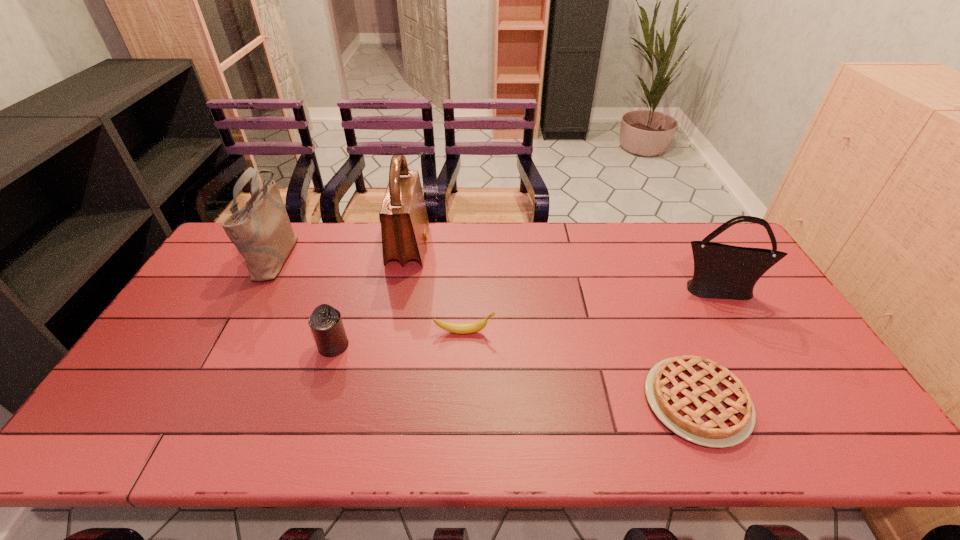
You are a GUI agent. You are given a task and a screenshot of the screen. Output one action in this format:
    pyautogui.click(x=<x>, y=<y>)
    Task: Click on the fourth object from right to left
    The height and width of the screenshot is (540, 960).
    Given the screenshot: What is the action you would take?
    pyautogui.click(x=404, y=221)

I want to click on the leftmost object, so click(x=261, y=230).

You are a GUI agent. You are given a task and a screenshot of the screen. Output one action in this format:
    pyautogui.click(x=<x>, y=<y>)
    Task: Click on the third tallest object
    
    Given the screenshot: What is the action you would take?
    pyautogui.click(x=721, y=271)

Find the location of a particular element. The width and height of the screenshot is (960, 540). the shortest shoulder bag is located at coordinates (721, 271).

The width and height of the screenshot is (960, 540). I want to click on the third shortest object, so click(x=325, y=322).

Find the location of a particular element. The height and width of the screenshot is (540, 960). can is located at coordinates (325, 322).

Locate an element on the screen. Image resolution: width=960 pixels, height=540 pixels. banana is located at coordinates (459, 328).

Where is `the second shortest object`? the second shortest object is located at coordinates (459, 328).

You are a GUI agent. You are given a task and a screenshot of the screen. Output one action in this format:
    pyautogui.click(x=<x>, y=<y>)
    Task: Click on the nearest object
    
    Given the screenshot: What is the action you would take?
    pyautogui.click(x=698, y=399)

Where is `pie`? pie is located at coordinates (698, 399).